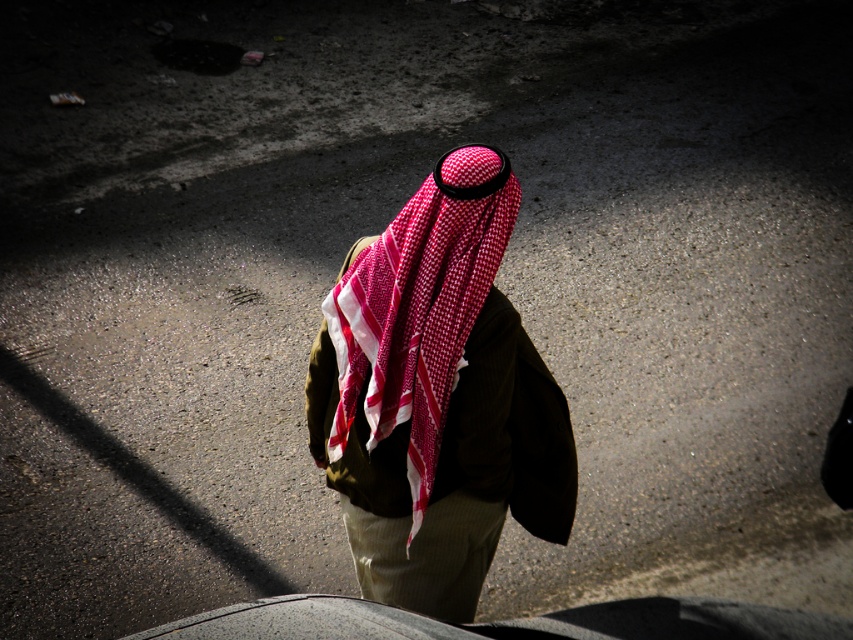
You are a GUI agent. You are given a task and a screenshot of the screen. Output one action in this format:
    pyautogui.click(x=<x>, y=<y>)
    Task: Click on the red checkered headscarf at center
    The height and width of the screenshot is (640, 853).
    Given the screenshot: What is the action you would take?
    [x=437, y=396]

Between point (343, 422) and point (415, 548), which one is positioned in front?

Point (343, 422) is more forward.

The image size is (853, 640). Find the location of `red checkered headscarf at center`. red checkered headscarf at center is located at coordinates (437, 396).

Identify the location of red checkered headscarf at center. (437, 396).